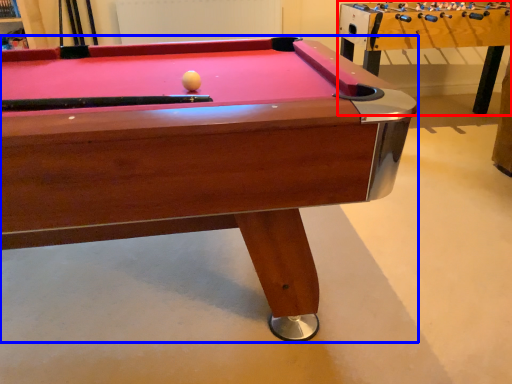
Question: Among these objects, which one is farthest to the camera, table (highlighted by a red box) or billiard table (highlighted by a blue box)?

Choices:
 (A) table
 (B) billiard table

Answer: (A)